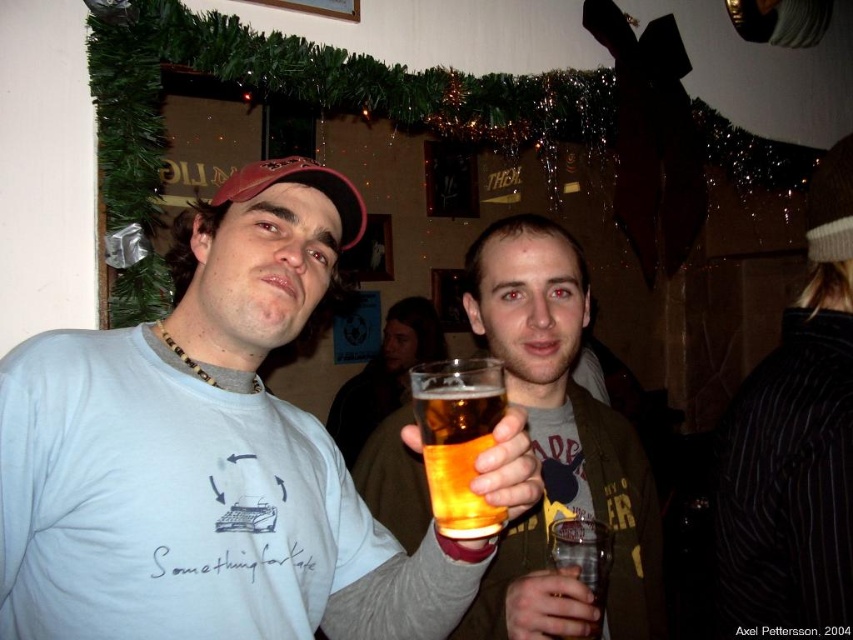
You are at a party and want to pour a drink into one of the containers. The drink you have is 150ml. Which container, the translucent glass at center or the translucent plastic cup at center, can hold the drink without spilling?

The translucent plastic cup at center can hold the drink without spilling because its width is greater than the translucent glass at center, allowing it to accommodate more liquid.

Looking at this image, you are standing at the entrance of the room and want to grab the translucent glass at center. Which direction should you move relative to the entrance?

The translucent glass at center is located at coordinates 0.688 on the x axis and 0.538 on the y axis. Since the entrance is typically at the front of the room, moving towards the center would involve moving forward and slightly to the right.